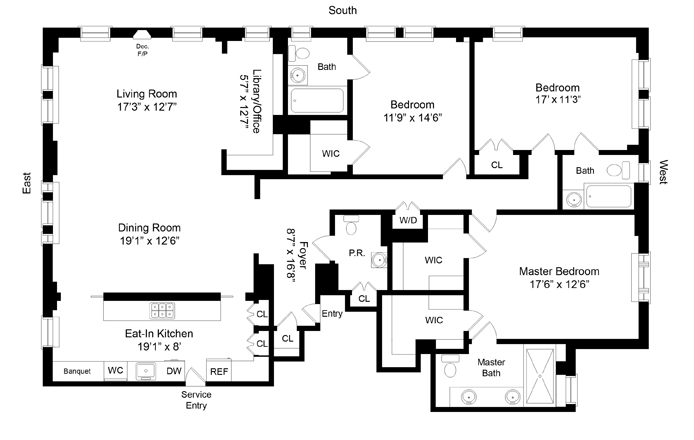
Locate an element on the screen. This screenshot has height=440, width=694. bath is located at coordinates (323, 80).